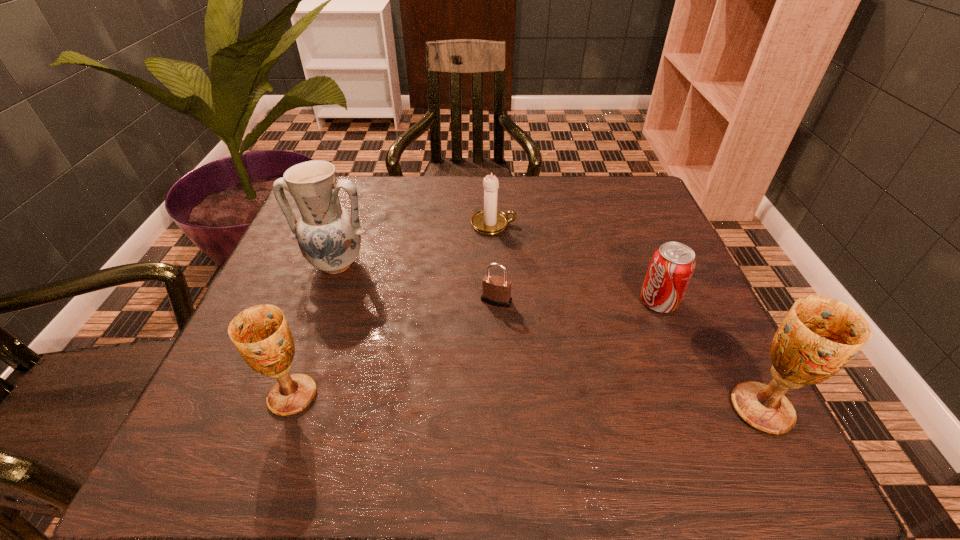
The height and width of the screenshot is (540, 960). What are the coordinates of `the shorter chalice` in the screenshot? It's located at point(261,335).

The height and width of the screenshot is (540, 960). I want to click on the left chalice, so click(261, 335).

Identify the location of the right chalice. The height and width of the screenshot is (540, 960). (819, 335).

At what (x,y) coordinates should I click in order to perform the action: click on the rightmost object. Please return your answer as a coordinate pair (x, y). The image size is (960, 540). Looking at the image, I should click on (819, 335).

This screenshot has width=960, height=540. Identify the location of the farthest object. (488, 221).

You are a GUI agent. You are given a task and a screenshot of the screen. Output one action in this format:
    pyautogui.click(x=<x>, y=<y>)
    Task: Click on the fifth nearest object
    The height and width of the screenshot is (540, 960).
    Given the screenshot: What is the action you would take?
    pyautogui.click(x=329, y=237)

I want to click on soda, so click(x=671, y=268).

Find the location of a particular element. Image resolution: width=960 pixels, height=540 pixels. the shortest object is located at coordinates (496, 290).

Locate an element on the screen. free space located on the back of the fourth shortest object is located at coordinates (348, 238).

Image resolution: width=960 pixels, height=540 pixels. I want to click on blank space located on the back of the taller chalice, so click(x=734, y=356).